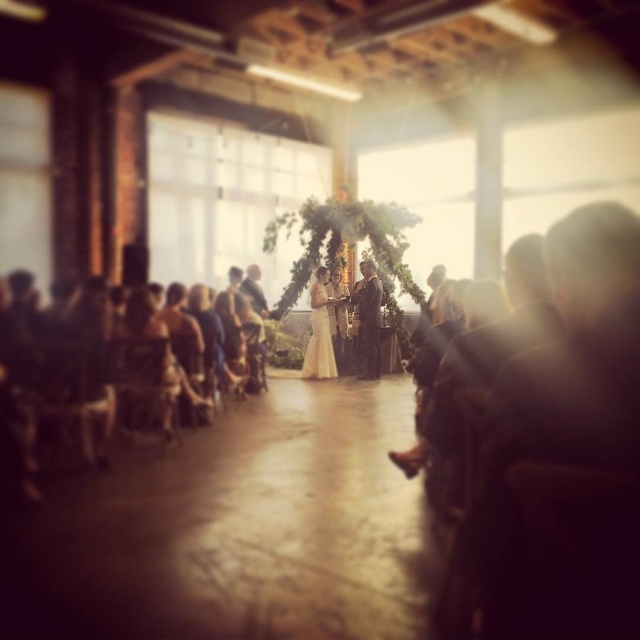
Question: Which of these objects is positioned closest to the wooden chair at left?

Choices:
 (A) dark brown leather jacket at center
 (B) smooth wooden floor at center

Answer: (B)

Question: Which object appears farthest from the camera in this image?

Choices:
 (A) smooth wooden floor at center
 (B) dark brown leather jacket at center
 (C) wooden chair at left

Answer: (B)

Question: Is smooth wooden floor at center to the left of white satin dress at center from the viewer's perspective?

Choices:
 (A) no
 (B) yes

Answer: (B)

Question: Observing the image, what is the correct spatial positioning of smooth wooden floor at center in reference to wooden chair at left?

Choices:
 (A) left
 (B) right

Answer: (B)

Question: Among these objects, which one is farthest from the camera?

Choices:
 (A) dark brown leather jacket at center
 (B) white satin dress at center

Answer: (A)

Question: Can you confirm if smooth wooden floor at center is wider than dark brown leather jacket at center?

Choices:
 (A) yes
 (B) no

Answer: (A)